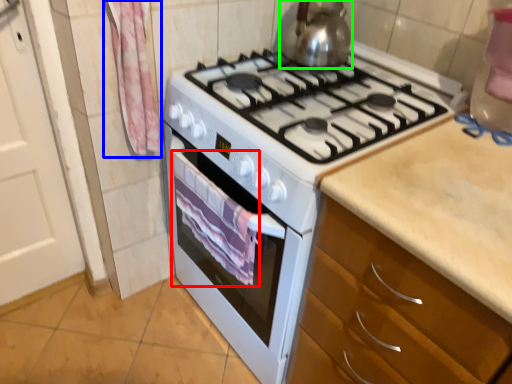
Question: Which is nearer to the blanket (highlighted by a red box)? curtain (highlighted by a blue box) or kitchen appliance (highlighted by a green box).

Choices:
 (A) curtain
 (B) kitchen appliance

Answer: (A)